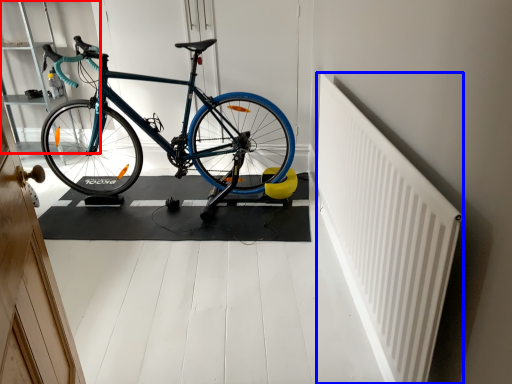
Question: Which object is closer to the camera taking this photo, shelf (highlighted by a red box) or radiator (highlighted by a blue box)?

Choices:
 (A) shelf
 (B) radiator

Answer: (B)